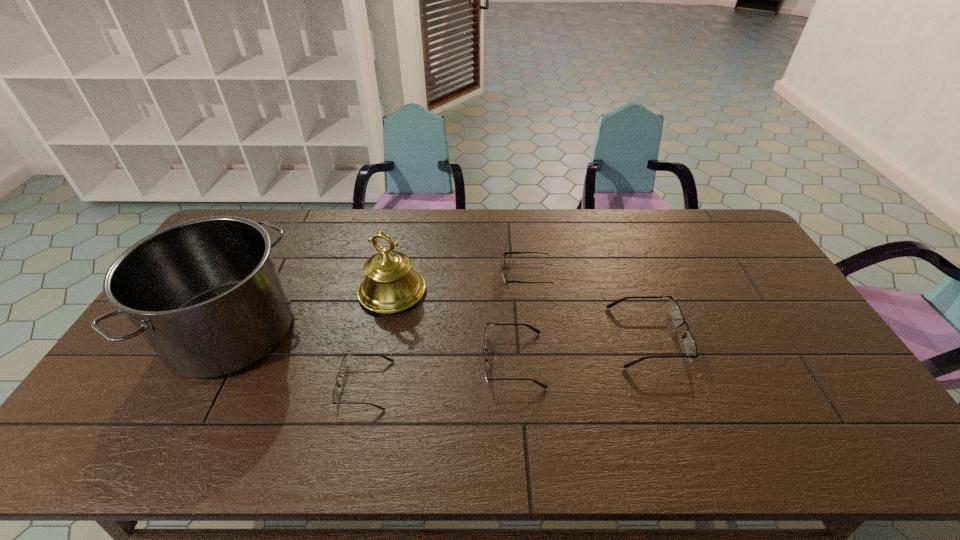
Locate an element on the screen. vacant area between the bell and the leftmost spectacles is located at coordinates (378, 338).

Where is `empty space between the rightmost spectacles and the leftmost spectacles`? Image resolution: width=960 pixels, height=540 pixels. empty space between the rightmost spectacles and the leftmost spectacles is located at coordinates (506, 361).

You are a GUI agent. You are given a task and a screenshot of the screen. Output one action in this format:
    pyautogui.click(x=<x>, y=<y>)
    Task: Click on the object that is the second nearest to the bell
    The image size is (960, 540).
    Given the screenshot: What is the action you would take?
    pyautogui.click(x=344, y=363)

Where is `the second closest object to the second spectacles from left to right`? This screenshot has width=960, height=540. the second closest object to the second spectacles from left to right is located at coordinates click(390, 285).

You are a GUI agent. You are given a task and a screenshot of the screen. Output one action in this format:
    pyautogui.click(x=<x>, y=<y>)
    Task: Click on the spectacles that is the closest to the tallest spectacles
    
    Given the screenshot: What is the action you would take?
    pyautogui.click(x=532, y=328)

Select which spectacles is the second closest to the sunglasses. Please provide its 2D coordinates. Your answer should be formatted as a tuple, i.e. [(x, y)], where the tuple contains the x and y coordinates of a point satisfying the conditions above.

[(532, 328)]

In order to click on free region that satisfies the following two spatial constraints: 1. on the back side of the leftmost object; 2. on the left side of the bell in this screenshot , I will do `click(252, 291)`.